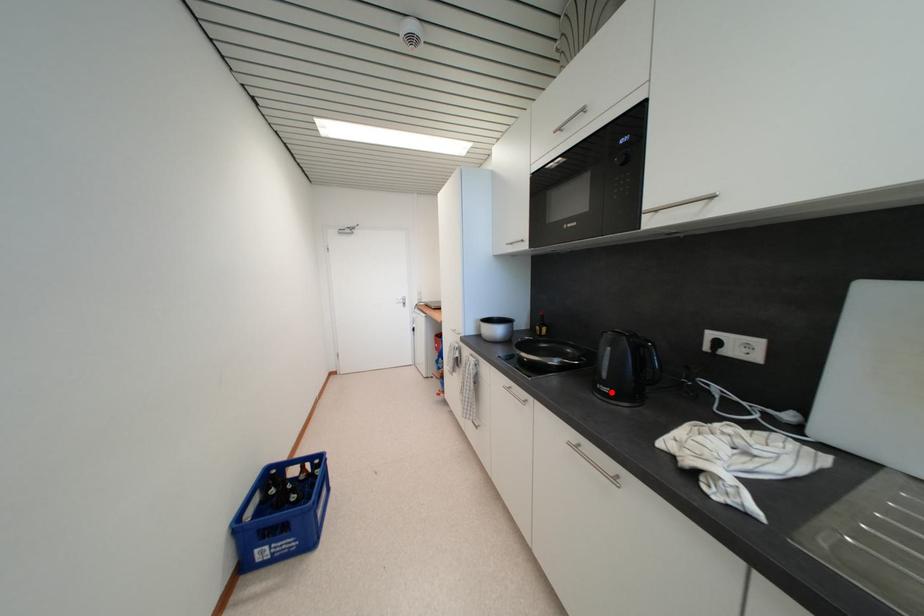
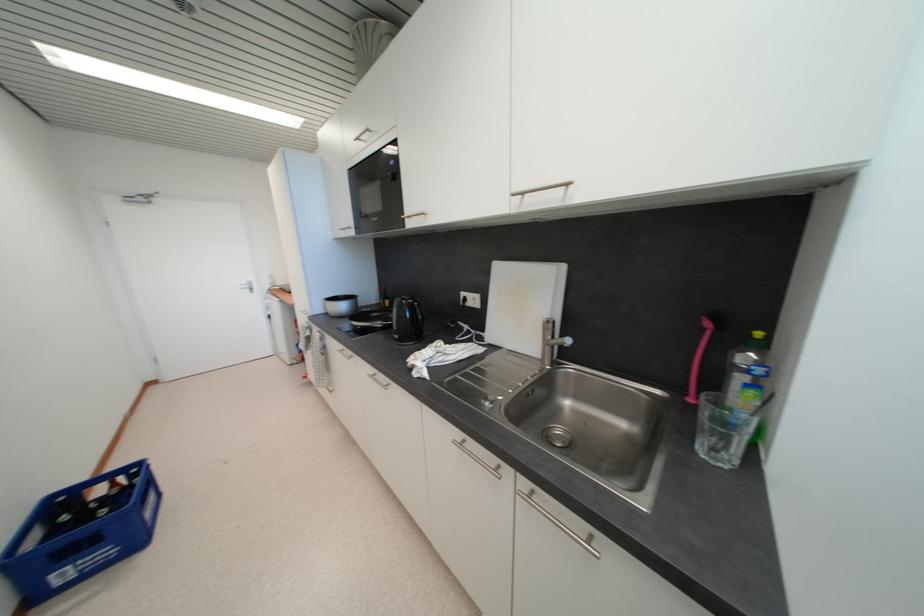
The point at the highlighted location is marked in the first image. Where is the corresponding point in the second image?

(402, 339)